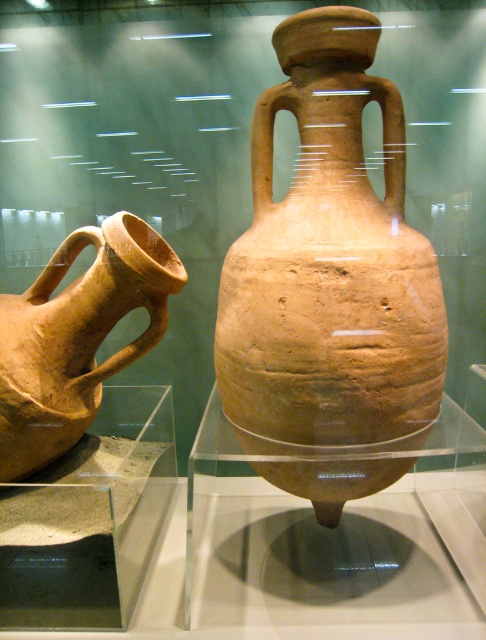
Question: Can you confirm if brown matte amphora at center is positioned to the left of matte clay jug at left?

Choices:
 (A) no
 (B) yes

Answer: (A)

Question: Among these points, which one is nearest to the camera?

Choices:
 (A) (125, 365)
 (B) (396, 342)

Answer: (B)

Question: Among these points, which one is farthest from the camera?

Choices:
 (A) (135, 273)
 (B) (225, 360)

Answer: (A)

Question: Does brown matte amphora at center appear over matte clay jug at left?

Choices:
 (A) no
 (B) yes

Answer: (B)

Question: In this image, where is brown matte amphora at center located relative to matte clay jug at left?

Choices:
 (A) above
 (B) below

Answer: (A)

Question: Which of the following is the closest to the observer?

Choices:
 (A) (24, 426)
 (B) (335, 340)

Answer: (B)